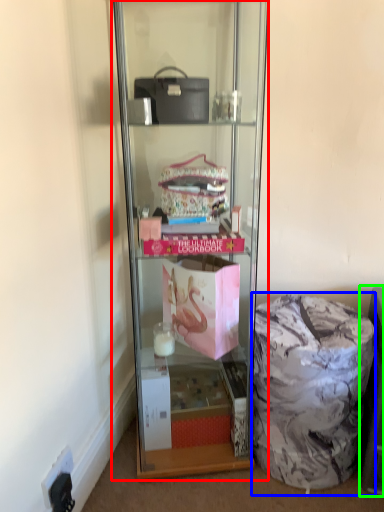
Question: Which is nearer to the shelf (highlighted by a red box)? garbage (highlighted by a blue box) or cabinet (highlighted by a green box).

Choices:
 (A) garbage
 (B) cabinet

Answer: (A)